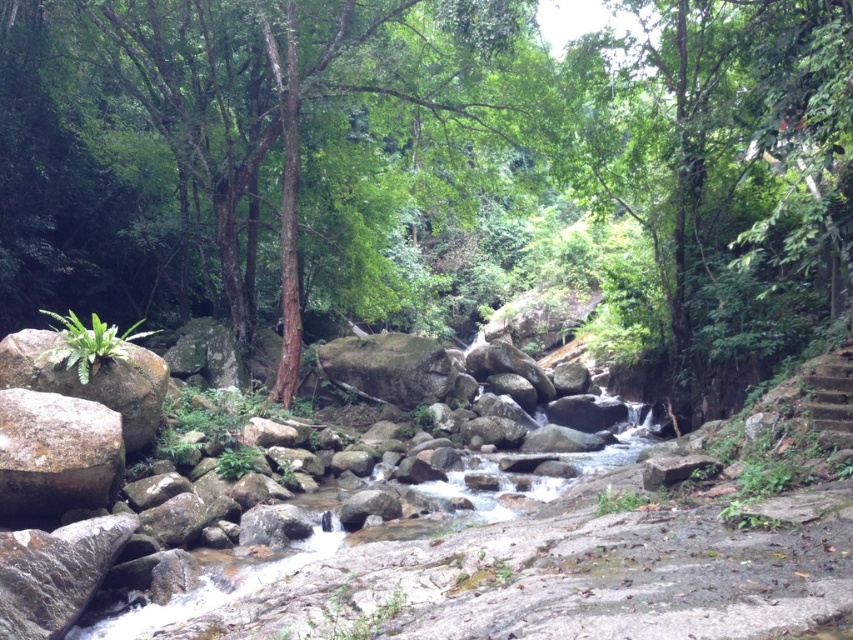
Image resolution: width=853 pixels, height=640 pixels. In order to click on green leafy tree at center in this screenshot , I will do `click(434, 170)`.

Is green leafy tree at center thinner than gray rough boulder at left?

No, green leafy tree at center is not thinner than gray rough boulder at left.

Between point (317, 97) and point (97, 445), which one is positioned in front?

Point (97, 445)

The width and height of the screenshot is (853, 640). I want to click on green leafy tree at center, so click(x=434, y=170).

Is clear water at center thinner than gray rough boulder at left?

In fact, clear water at center might be wider than gray rough boulder at left.

How much distance is there between clear water at center and gray rough boulder at left?

clear water at center is 8.73 feet from gray rough boulder at left.

Does point (207, 576) come in front of point (42, 513)?

Yes, it is.

The height and width of the screenshot is (640, 853). I want to click on clear water at center, so click(x=325, y=545).

Is green leafy tree at center shorter than clear water at center?

No.

Does green leafy tree at center lie behind clear water at center?

That is True.

Between point (281, 22) and point (155, 618), which one is positioned behind?

The point (281, 22) is more distant.

Image resolution: width=853 pixels, height=640 pixels. In order to click on green leafy tree at center in this screenshot , I will do `click(434, 170)`.